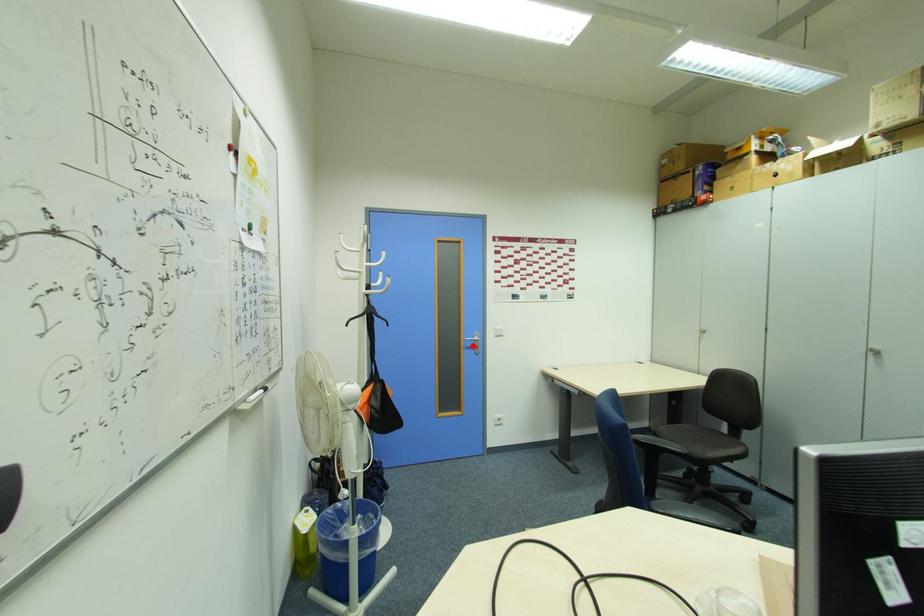
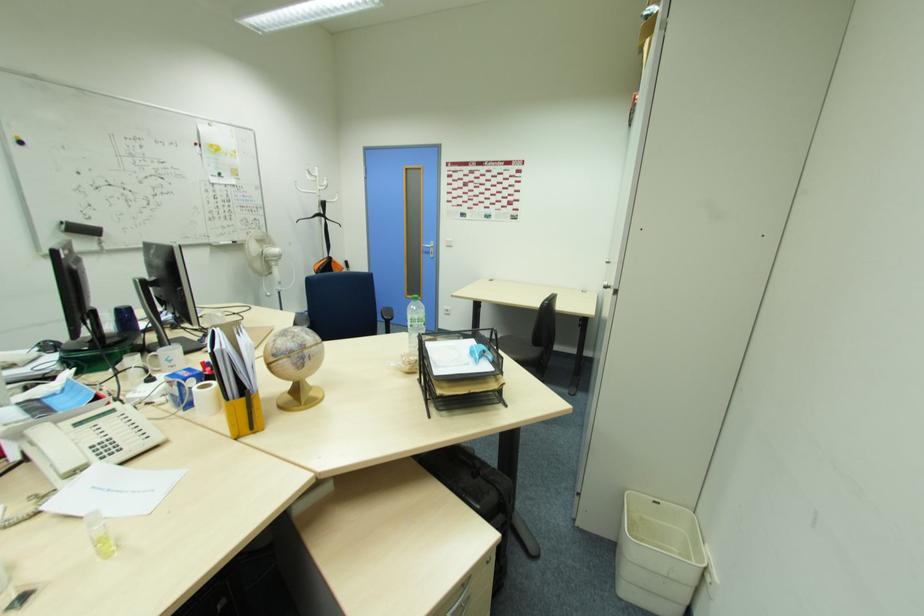
Find the pixel in the second image that matches the highlighted location in the first image.

(430, 252)